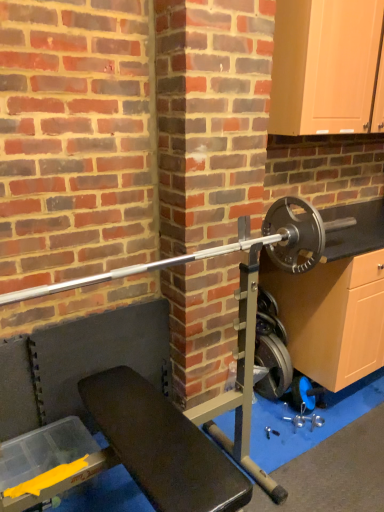
Question: Should I look upward or downward to see matte wood cabinet at upper right?

Choices:
 (A) down
 (B) up

Answer: (B)